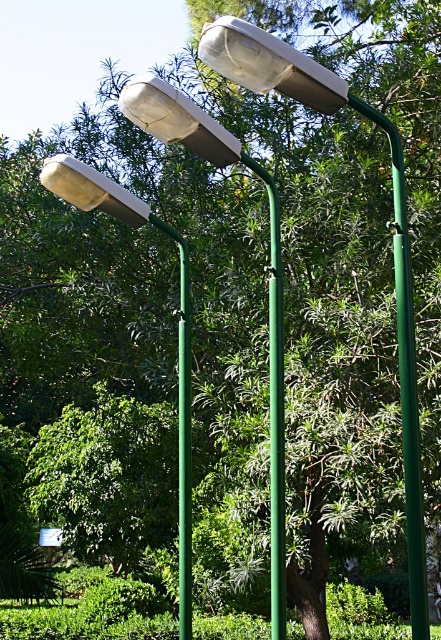
Who is lower down, green matte pole at center or matte white lamp at upper left?

green matte pole at center is below.

Between point (421, 586) and point (85, 182), which one is positioned behind?

Point (85, 182)

Where is `green matte pole at center`? green matte pole at center is located at coordinates (406, 378).

Can you confirm if white glossy street light at center is shorter than matte white lamp at upper center?

In fact, white glossy street light at center may be taller than matte white lamp at upper center.

The height and width of the screenshot is (640, 441). What do you see at coordinates (269, 276) in the screenshot?
I see `white glossy street light at center` at bounding box center [269, 276].

This screenshot has height=640, width=441. I want to click on white glossy street light at center, so click(x=269, y=276).

Can you confirm if white glossy street light at center is wider than white matte streetlight at upper center?

Correct, the width of white glossy street light at center exceeds that of white matte streetlight at upper center.

Who is shorter, white glossy street light at center or white matte streetlight at upper center?

white matte streetlight at upper center is shorter.

Find the location of a particular element. white glossy street light at center is located at coordinates (269, 276).